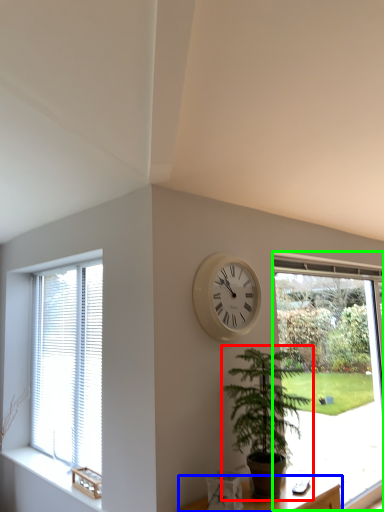
Question: Which is farther away from houseplant (highlighted by a red box)? furniture (highlighted by a blue box) or window (highlighted by a green box)?

Choices:
 (A) furniture
 (B) window

Answer: (B)